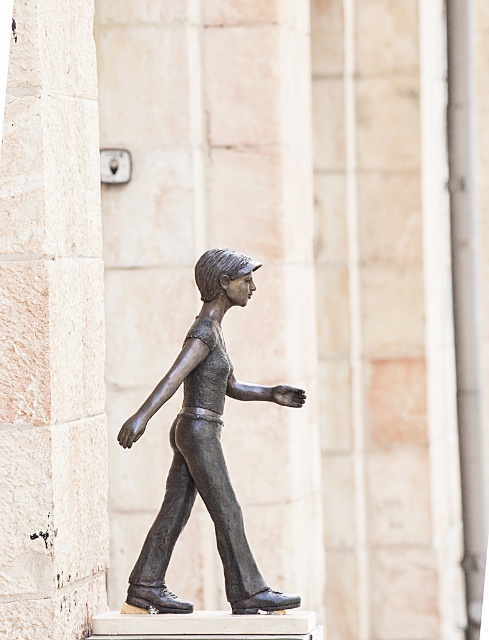
Question: Which object is farther from the camera taking this photo?

Choices:
 (A) bronze statue at center
 (B) beige stone pillar at center

Answer: (B)

Question: Can you confirm if beige stone pillar at center is positioned to the left of bronze statue at center?

Choices:
 (A) no
 (B) yes

Answer: (B)

Question: Among these points, which one is nearest to the camera?

Choices:
 (A) (8, 237)
 (B) (222, 548)

Answer: (A)

Question: Can you confirm if beige stone pillar at center is positioned to the left of bronze statue at center?

Choices:
 (A) no
 (B) yes

Answer: (B)

Question: Is beige stone pillar at center positioned in front of bronze statue at center?

Choices:
 (A) yes
 (B) no

Answer: (B)